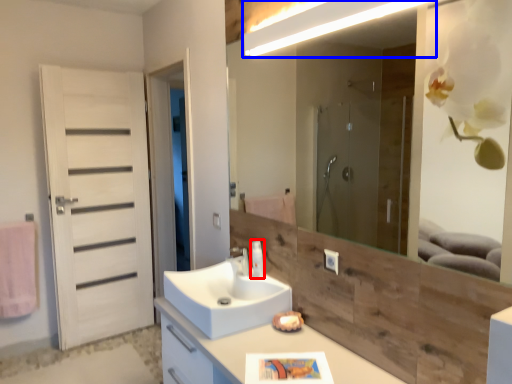
Question: Which of the following is the farthest to the observer, soap dispenser (highlighted by a red box) or light fixture (highlighted by a blue box)?

Choices:
 (A) soap dispenser
 (B) light fixture

Answer: (A)